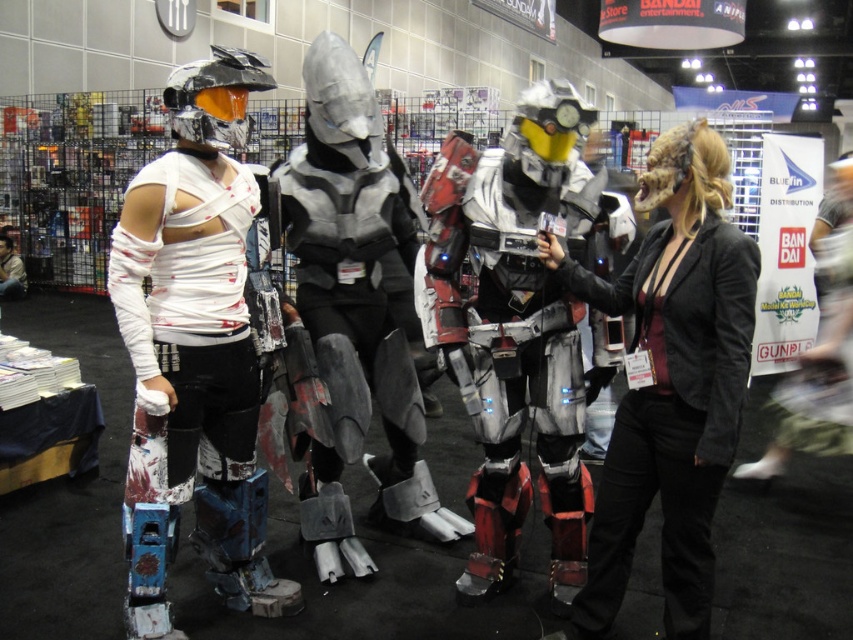
Question: Can you confirm if white bandaged armor at left is positioned to the left of black leather jacket at center?

Choices:
 (A) yes
 (B) no

Answer: (A)

Question: Is white bandaged armor at left below silver metallic armor at center?

Choices:
 (A) no
 (B) yes

Answer: (B)

Question: Which object appears closest to the camera in this image?

Choices:
 (A) red and white metallic armor at center
 (B) silver metallic armor at center
 (C) black leather jacket at center

Answer: (C)

Question: Which of the following is the closest to the observer?

Choices:
 (A) silver metallic armor at center
 (B) white bandaged armor at left

Answer: (B)

Question: Which of the following is the closest to the observer?

Choices:
 (A) (512, 410)
 (B) (750, 275)

Answer: (B)

Question: Can you confirm if red and white metallic armor at center is bigger than black leather jacket at center?

Choices:
 (A) yes
 (B) no

Answer: (A)